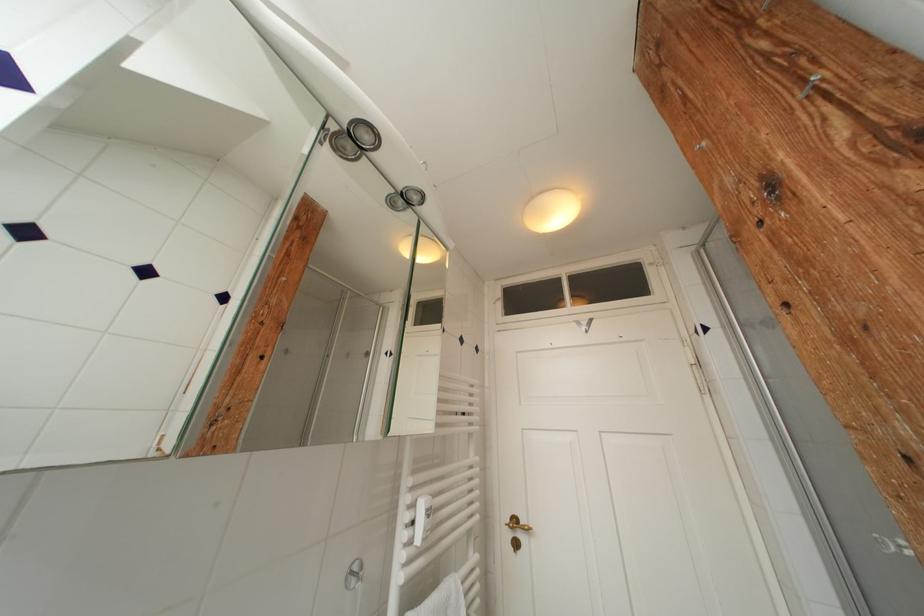
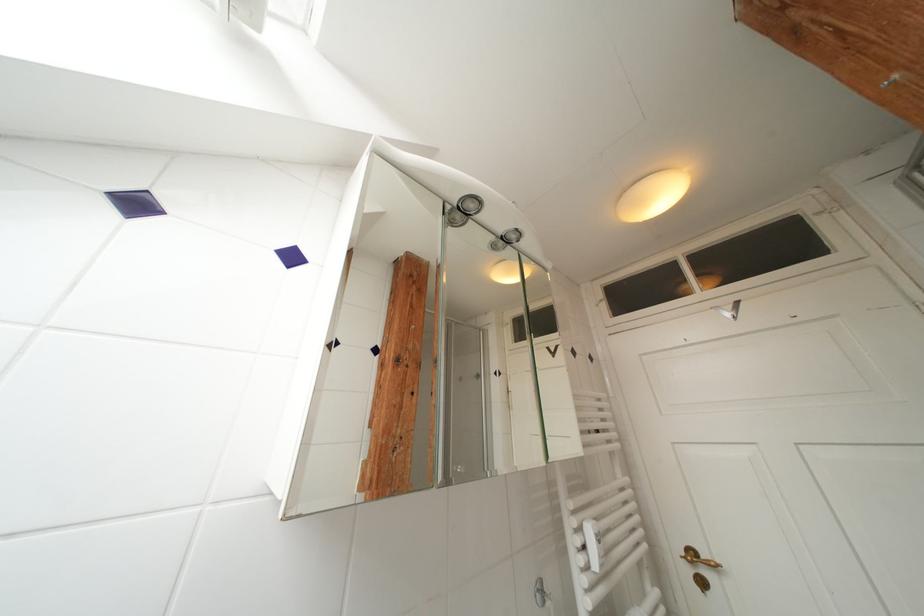
In the second image, find the point that corresponds to the point at 585,326 in the first image.

(724, 312)